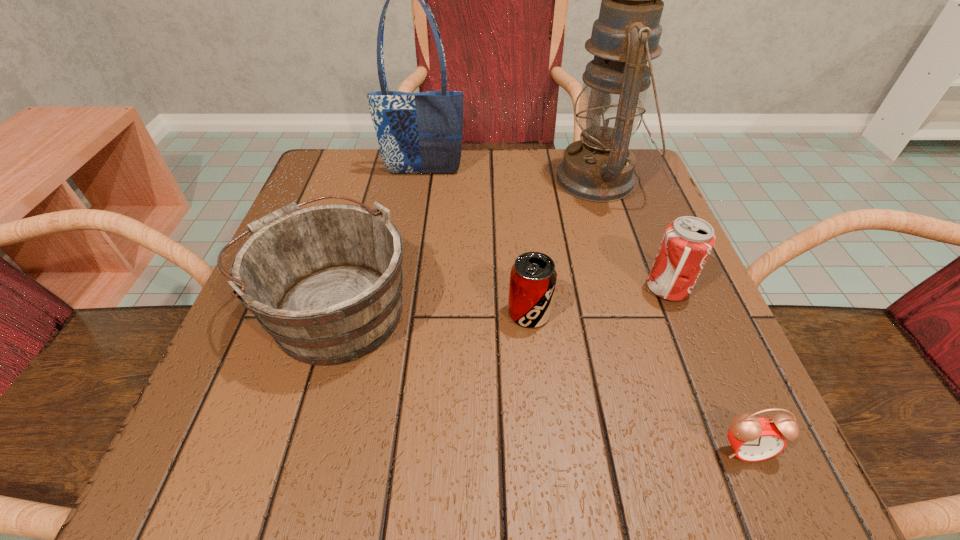
Find the location of `object that is the fourth closest to the taller soda can`. object that is the fourth closest to the taller soda can is located at coordinates (325, 281).

Where is `free point that satisfies the following two spatial constraints: 1. on the front-facing side of the shorter soda can; 2. on the left side of the shopping bag`? free point that satisfies the following two spatial constraints: 1. on the front-facing side of the shorter soda can; 2. on the left side of the shopping bag is located at coordinates (400, 313).

Where is `vacant position in the image that satisfies the following two spatial constraints: 1. on the front-facing side of the shopping bag; 2. on the right side of the left soda can`? vacant position in the image that satisfies the following two spatial constraints: 1. on the front-facing side of the shopping bag; 2. on the right side of the left soda can is located at coordinates (400, 313).

Identify the location of vacant space that satisfies the following two spatial constraints: 1. on the front-facing side of the shopping bag; 2. on the left side of the right soda can. Image resolution: width=960 pixels, height=540 pixels. (405, 288).

In order to click on free spot that satisfies the following two spatial constraints: 1. on the front-facing side of the shorter soda can; 2. on the right side of the shopping bag in this screenshot , I will do `click(400, 313)`.